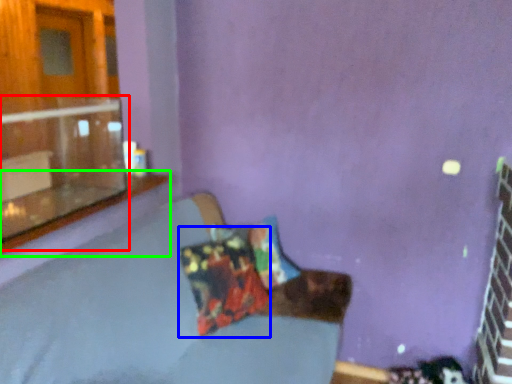
Question: Which object is positioned farthest from window (highlighted by a red box)? Select from pillow (highlighted by a blue box) and window sill (highlighted by a green box).

Choices:
 (A) pillow
 (B) window sill

Answer: (A)